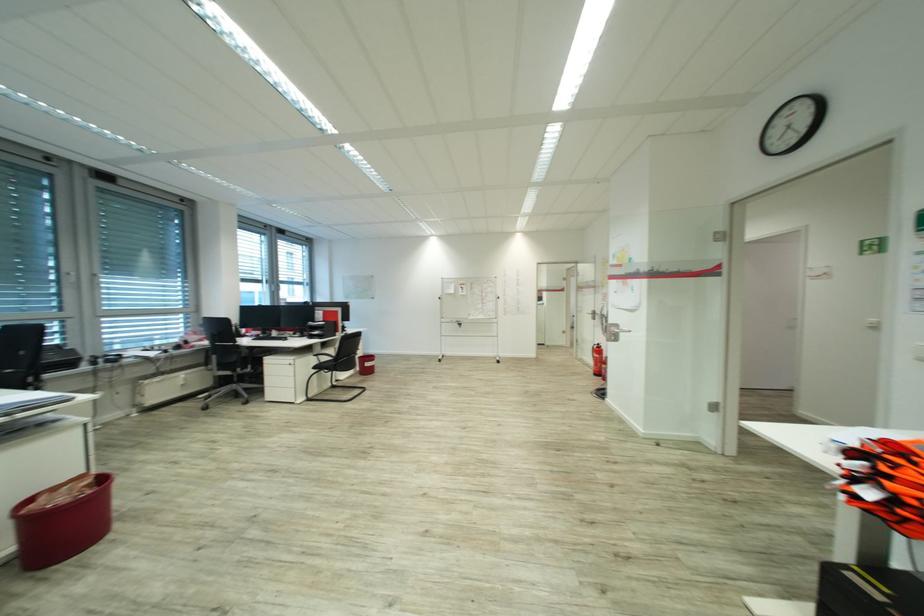
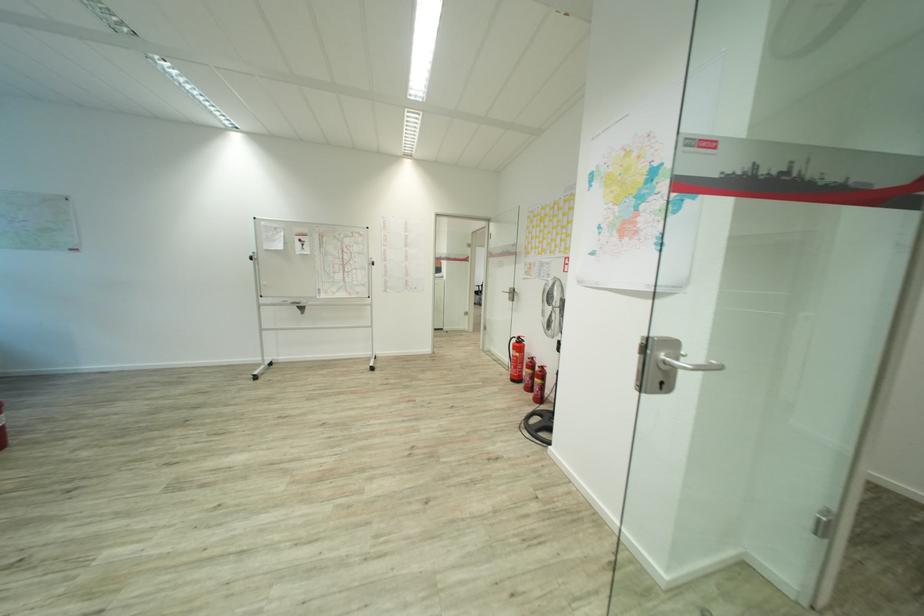
Question: In a continuous first-person perspective shot, in which direction is the camera moving?

Choices:
 (A) Left
 (B) Right
 (C) Forward
 (D) Backward

Answer: (C)